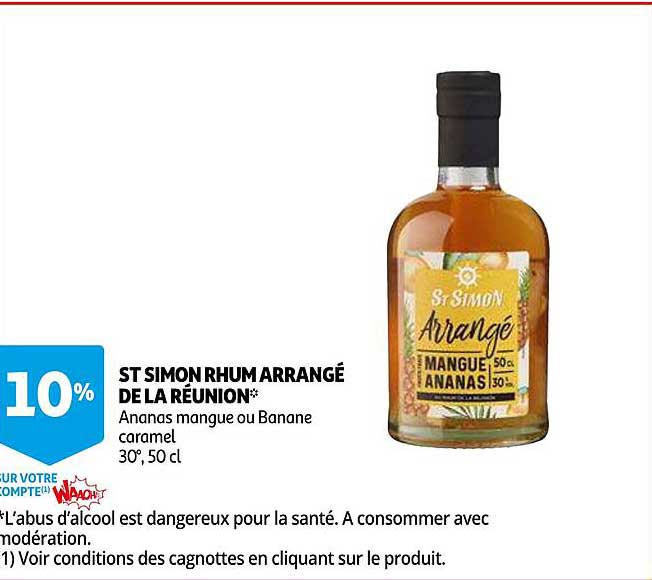
Locate an element on the screen. The height and width of the screenshot is (580, 652). bottle is located at coordinates (462, 218).